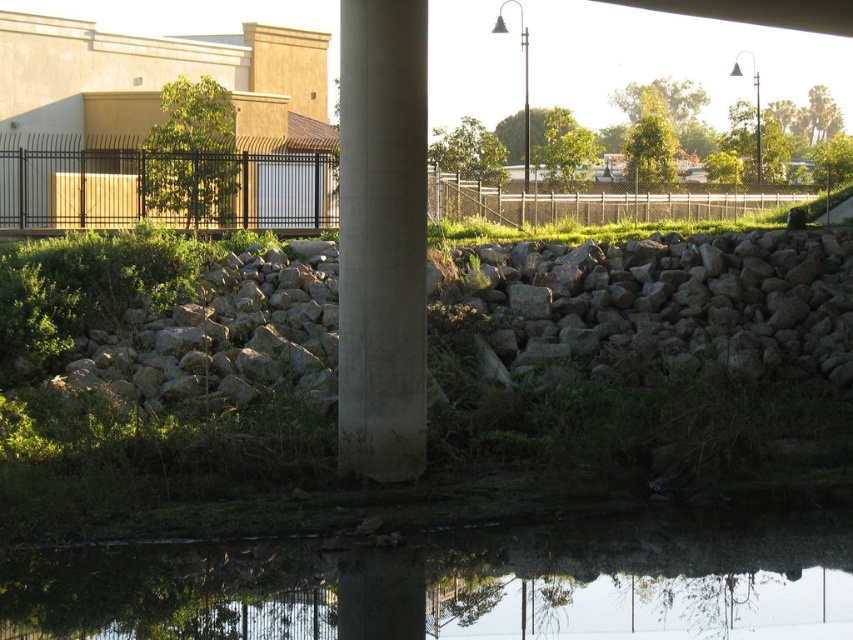
Is gray rough stone at center to the left of smooth concrete pillar at center from the viewer's perspective?

Incorrect, gray rough stone at center is not on the left side of smooth concrete pillar at center.

Where is `gray rough stone at center`? gray rough stone at center is located at coordinates (670, 307).

Which is in front, point (663, 308) or point (392, 348)?

Positioned in front is point (392, 348).

At what (x,y) coordinates should I click in order to perform the action: click on gray rough stone at center. Please return your answer as a coordinate pair (x, y). Looking at the image, I should click on (670, 307).

Is point (291, 634) positioned after point (793, 280)?

That is False.

Is the position of transparent glass water at center bottom less distant than that of gray rough stone at center?

Yes, it is.

The width and height of the screenshot is (853, 640). I want to click on transparent glass water at center bottom, so click(450, 582).

You are a GUI agent. You are given a task and a screenshot of the screen. Output one action in this format:
    pyautogui.click(x=<x>, y=<y>)
    Task: Click on the transparent glass water at center bottom
    The image size is (853, 640).
    Given the screenshot: What is the action you would take?
    pyautogui.click(x=450, y=582)

The width and height of the screenshot is (853, 640). What do you see at coordinates (450, 582) in the screenshot?
I see `transparent glass water at center bottom` at bounding box center [450, 582].

Does transparent glass water at center bottom appear under smooth concrete pillar at center?

Yes, transparent glass water at center bottom is below smooth concrete pillar at center.

Is point (294, 636) less distant than point (340, 442)?

That is True.

Locate an element on the screen. The height and width of the screenshot is (640, 853). transparent glass water at center bottom is located at coordinates (450, 582).